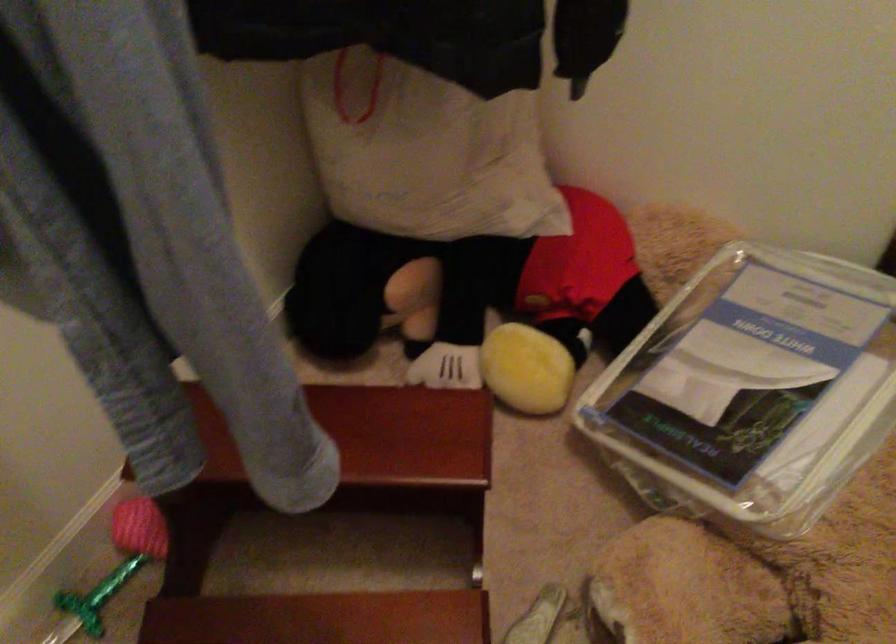
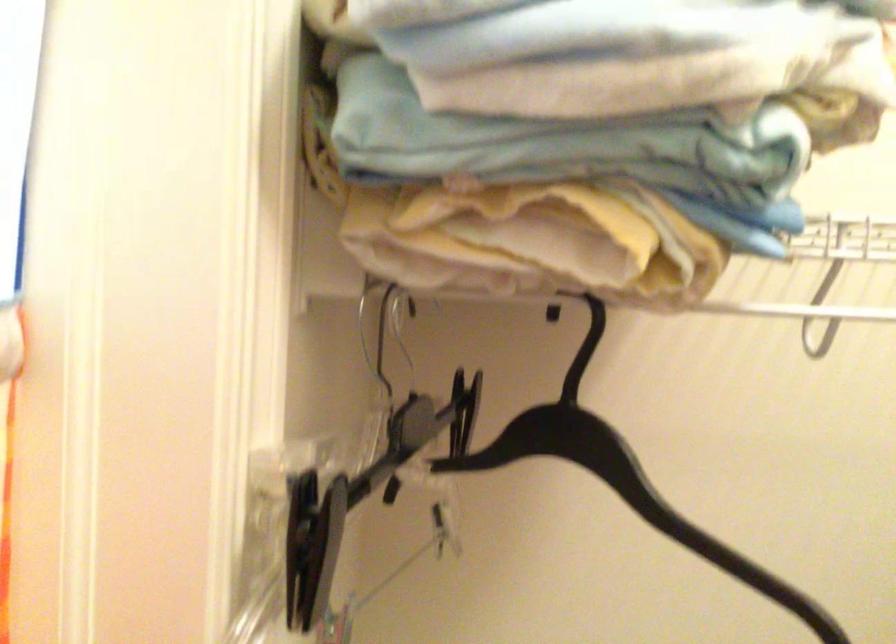
The images are taken continuously from a first-person perspective. In which direction is your viewpoint rotating?

The camera's rotation is toward left-up.